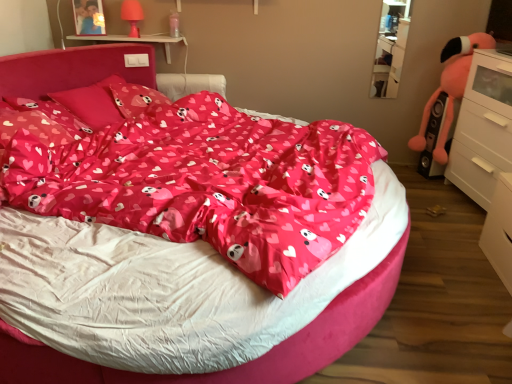
Question: Would you say white glossy chest of drawers at right contains fluffy pink stuffed animal at right?

Choices:
 (A) yes
 (B) no

Answer: (B)

Question: Is white glossy chest of drawers at right bigger than fluffy pink stuffed animal at right?

Choices:
 (A) yes
 (B) no

Answer: (A)

Question: Is white glossy chest of drawers at right positioned far away from fluffy pink stuffed animal at right?

Choices:
 (A) yes
 (B) no

Answer: (B)

Question: From a real-world perspective, is white glossy chest of drawers at right below fluffy pink stuffed animal at right?

Choices:
 (A) yes
 (B) no

Answer: (A)

Question: Is white glossy chest of drawers at right completely or partially outside of fluffy pink stuffed animal at right?

Choices:
 (A) no
 (B) yes

Answer: (B)

Question: In terms of size, does matte pink bed at center appear bigger or smaller than clear glass shelf at upper right?

Choices:
 (A) small
 (B) big

Answer: (B)

Question: Is matte pink bed at center wider or thinner than clear glass shelf at upper right?

Choices:
 (A) wide
 (B) thin

Answer: (A)

Question: From a real-world perspective, relative to clear glass shelf at upper right, is matte pink bed at center vertically above or below?

Choices:
 (A) above
 (B) below

Answer: (B)

Question: From the image's perspective, is matte pink bed at center above or below clear glass shelf at upper right?

Choices:
 (A) above
 (B) below

Answer: (B)

Question: In terms of height, does matte pink pillow at center, the second pillow from the front, look taller or shorter compared to white plastic table at upper center?

Choices:
 (A) tall
 (B) short

Answer: (A)

Question: Is matte pink pillow at center, arranged as the 2th pillow when viewed from the back, situated inside white plastic table at upper center or outside?

Choices:
 (A) inside
 (B) outside

Answer: (B)

Question: From the image's perspective, relative to white plastic table at upper center, is matte pink pillow at center, the second pillow from the front, above or below?

Choices:
 (A) above
 (B) below

Answer: (B)

Question: Is matte pink pillow at center, the second pillow from the front, wider or thinner than white plastic table at upper center?

Choices:
 (A) thin
 (B) wide

Answer: (B)

Question: Considering the positions of fluffy pink stuffed animal at right and clear glass shelf at upper right in the image, is fluffy pink stuffed animal at right wider or thinner than clear glass shelf at upper right?

Choices:
 (A) thin
 (B) wide

Answer: (B)

Question: From a real-world perspective, is fluffy pink stuffed animal at right physically located above or below clear glass shelf at upper right?

Choices:
 (A) above
 (B) below

Answer: (B)